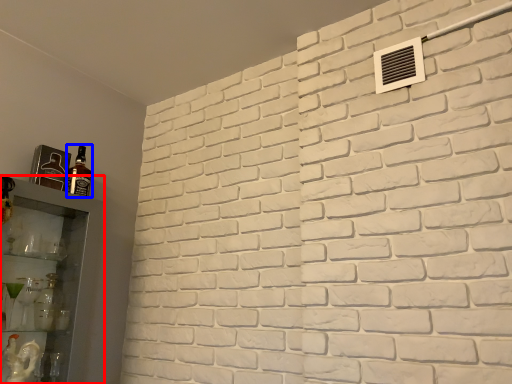
Question: Which point is further to the camera, shelf (highlighted by a red box) or bottle (highlighted by a blue box)?

Choices:
 (A) shelf
 (B) bottle

Answer: (B)